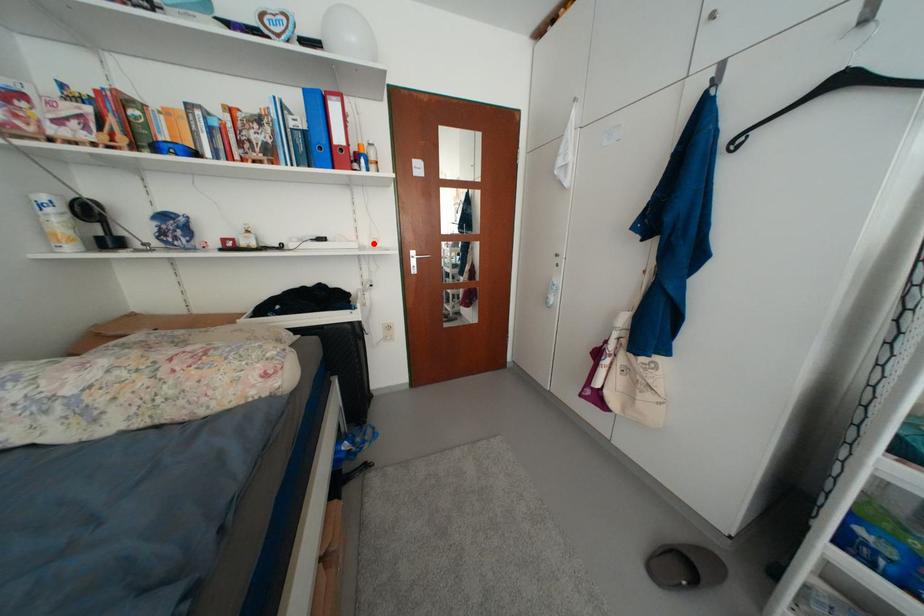
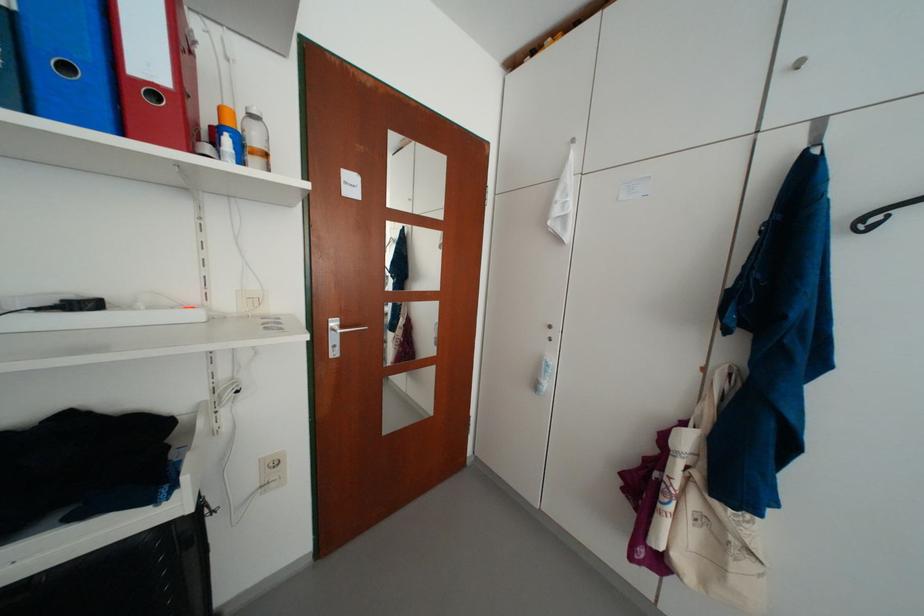
In the second image, find the point that corresponds to the highlighted location in the first image.

(236, 306)